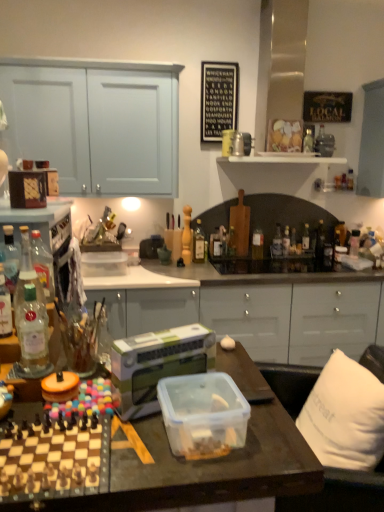
I want to click on vacant space in front of translucent glass bottle at center, positioned as the 8th bottle in left-to-right order, so click(x=276, y=264).